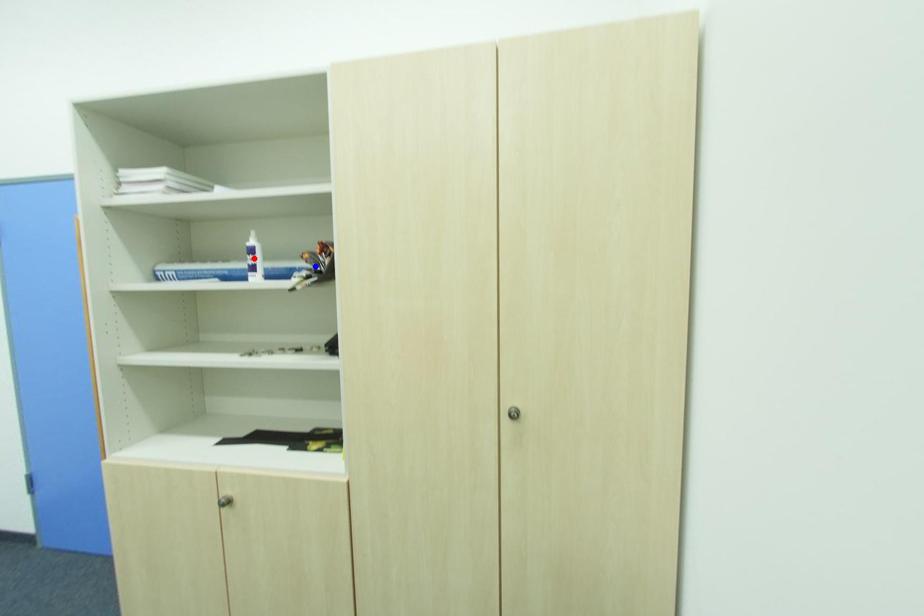
Question: Two points are marked on the image. Which point is closer to the camera?

Choices:
 (A) Blue point is closer.
 (B) Red point is closer.

Answer: (A)